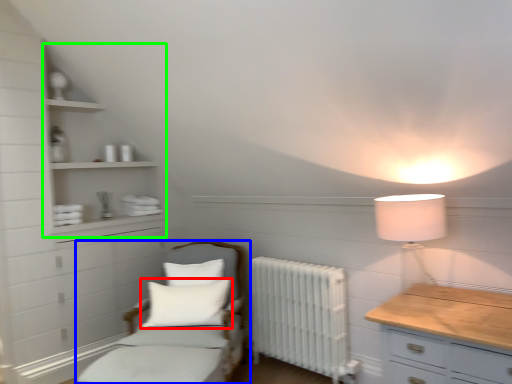
Question: Which is nearer to the pillow (highlighted by a red box)? furniture (highlighted by a blue box) or cabinet (highlighted by a green box).

Choices:
 (A) furniture
 (B) cabinet

Answer: (A)